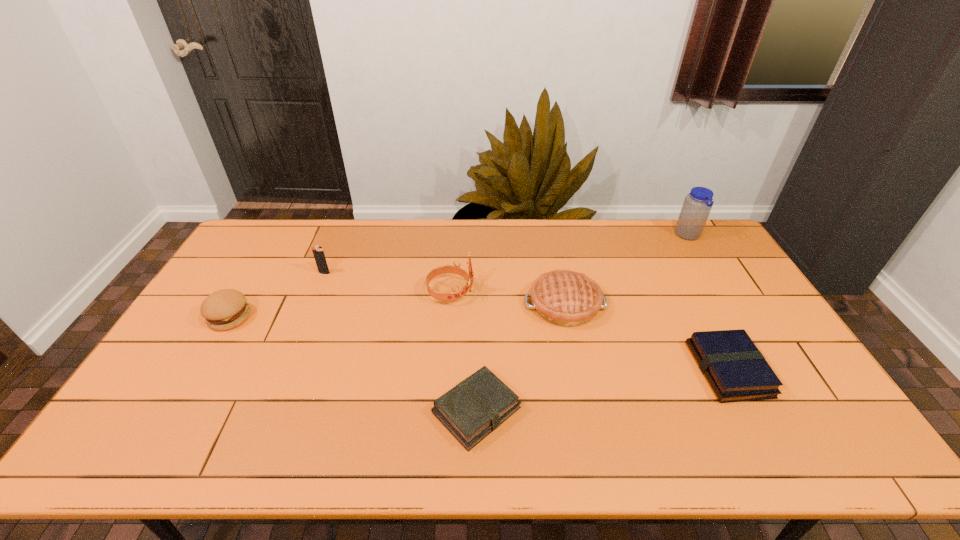
Where is `the farthest object`? the farthest object is located at coordinates (697, 205).

This screenshot has width=960, height=540. In order to click on tiara in this screenshot , I will do `click(456, 294)`.

The height and width of the screenshot is (540, 960). I want to click on the fifth shortest object, so click(x=318, y=252).

Where is `the second farthest object`? The width and height of the screenshot is (960, 540). the second farthest object is located at coordinates (318, 252).

Locate an element on the screen. the fifth object from left to right is located at coordinates (566, 298).

What are the coordinates of `the leftmost object` in the screenshot? It's located at (225, 309).

You are a GUI agent. You are given a task and a screenshot of the screen. Output one action in this format:
    pyautogui.click(x=<x>, y=<y>)
    Task: Click on the right book
    This screenshot has height=540, width=960.
    Given the screenshot: What is the action you would take?
    pos(735,369)

Where is `the left book`? Image resolution: width=960 pixels, height=540 pixels. the left book is located at coordinates (475, 407).

At what (x,y) coordinates should I click in order to perform the action: click on vacant area situated with a carrying loop on the side of the farthest object. Please return your answer as a coordinate pair (x, y). Looking at the image, I should click on (595, 236).

The height and width of the screenshot is (540, 960). Find the location of `vacant space situated with a carrying loop on the side of the farthest object`. vacant space situated with a carrying loop on the side of the farthest object is located at coordinates (654, 236).